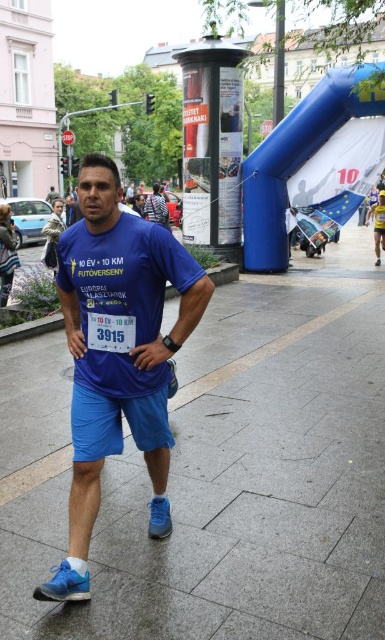
You are a photographer trying to capture the runner in the 10 km race. You need to ensure that both the gray concrete pavement at center and the blue fabric shorts at center are in focus. Given that your camera can only focus on objects within a 1.5 meter range, will you be able to capture both in focus?

The gray concrete pavement at center and blue fabric shorts at center are 1.38 meters apart from each other, so yes, the camera can focus on both since the distance between them is within the 1.5 meter range.

You are a participant in the 10 km race and need to check your race number. Where should you look first between the gray concrete pavement at center and the blue fabric shirt at center?

The blue fabric shirt at center is where the race number is located, so you should look there first.

In the scene shown: You are a runner participating in the 10 km race. You look down and see the point at coordinates (x=222, y=474). What is the color of the surface at that point?

The point at coordinates (x=222, y=474) is on gray concrete pavement at center, so the surface color is gray.